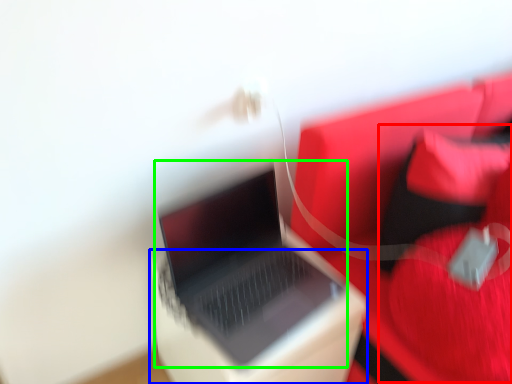
Question: Which is farther away from bean bag chair (highlighted by a red box)? cardboard box (highlighted by a blue box) or laptop (highlighted by a green box)?

Choices:
 (A) cardboard box
 (B) laptop

Answer: (B)